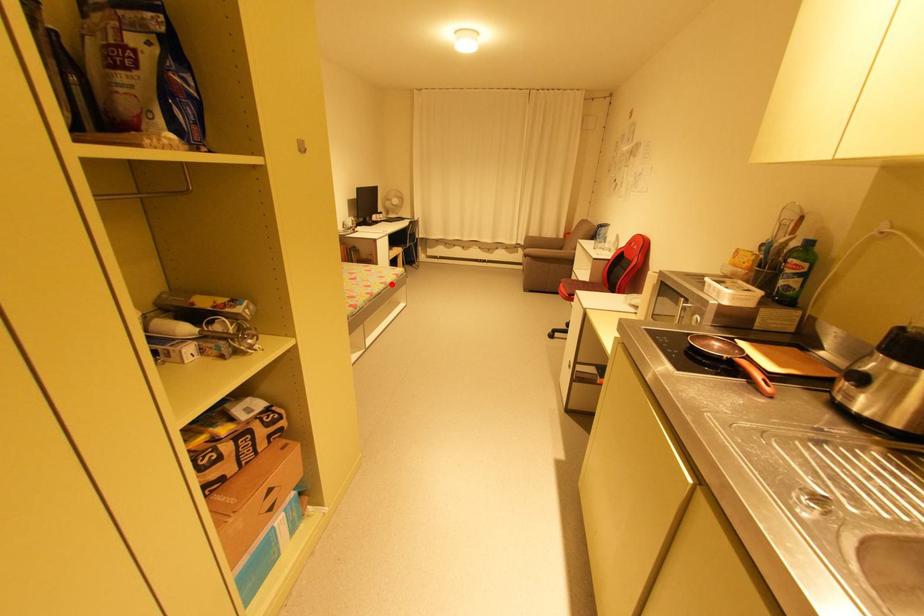
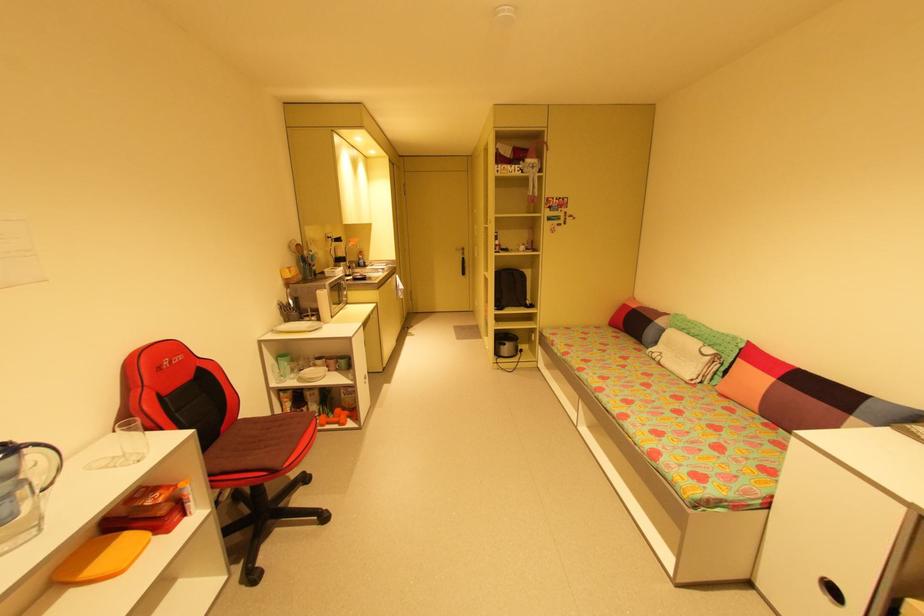
Where in the second image is the point corresponding to the highlighted location from the first image?

(625, 422)